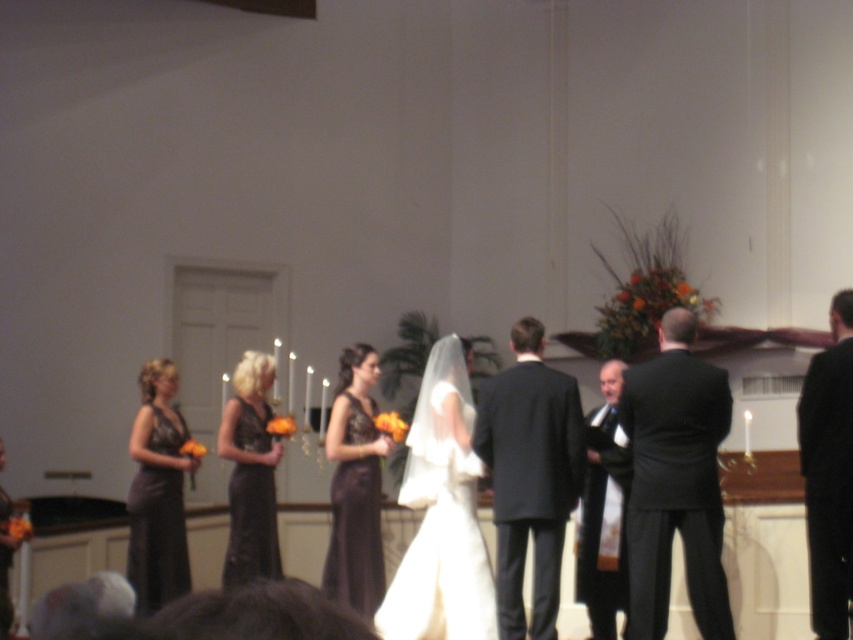
Is the position of matte black dress at center more distant than that of black suit at right?

That is True.

Who is lower down, matte black dress at center or black suit at right?

matte black dress at center

Find the location of `matte black dress at center`. matte black dress at center is located at coordinates (766, 545).

Which is behind, point (157, 547) or point (270, 451)?

Positioned behind is point (270, 451).

Between matte black dress at left and black satin dress at center, which one has more height?

A: Standing taller between the two is black satin dress at center.

Where is `matte black dress at left`? The image size is (853, 640). matte black dress at left is located at coordinates (157, 492).

Where is `matte black dress at left`? The image size is (853, 640). matte black dress at left is located at coordinates (157, 492).

Does black satin suit at right have a lesser height compared to matte black dress at left?

No.

Who is lower down, black satin suit at right or matte black dress at left?

matte black dress at left

Is point (625, 413) less distant than point (186, 564)?

Yes, point (625, 413) is in front of point (186, 564).

This screenshot has height=640, width=853. Identify the location of black satin suit at right. (675, 481).